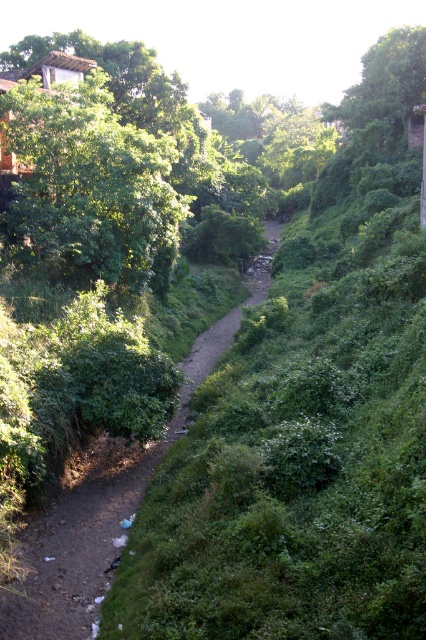
Identify the location of green leafy tree at upper left. The height and width of the screenshot is (640, 426). (91, 186).

Can you confirm if green leafy tree at upper left is positioned to the right of green leafy tree at upper right?

No, green leafy tree at upper left is not to the right of green leafy tree at upper right.

Measure the distance between green leafy tree at upper left and camera.

green leafy tree at upper left is 70.11 feet away from camera.

You are a GUI agent. You are given a task and a screenshot of the screen. Output one action in this format:
    pyautogui.click(x=<x>, y=<y>)
    Task: Click on the green leafy tree at upper left
    The image size is (426, 640).
    Given the screenshot: What is the action you would take?
    pyautogui.click(x=91, y=186)

Is point (63, 616) closer to camera compared to point (409, 32)?

Yes.

Who is more forward, (x=45, y=589) or (x=365, y=83)?

Positioned in front is point (x=45, y=589).

Locate an element on the screen. The image size is (426, 640). dirt path at center is located at coordinates (92, 522).

Where is `dirt path at center`? This screenshot has height=640, width=426. dirt path at center is located at coordinates (92, 522).

Locate an element on the screen. This screenshot has height=640, width=426. green leafy tree at upper left is located at coordinates (91, 186).

Between green leafy tree at upper left and dirt path at center, which one is positioned lower?

dirt path at center is below.

Where is `green leafy tree at upper left`? green leafy tree at upper left is located at coordinates (91, 186).